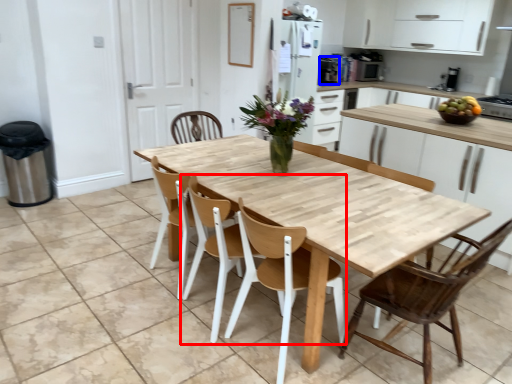
Question: Among these objects, which one is farthest to the camera, chair (highlighted by a red box) or appliance (highlighted by a blue box)?

Choices:
 (A) chair
 (B) appliance

Answer: (B)